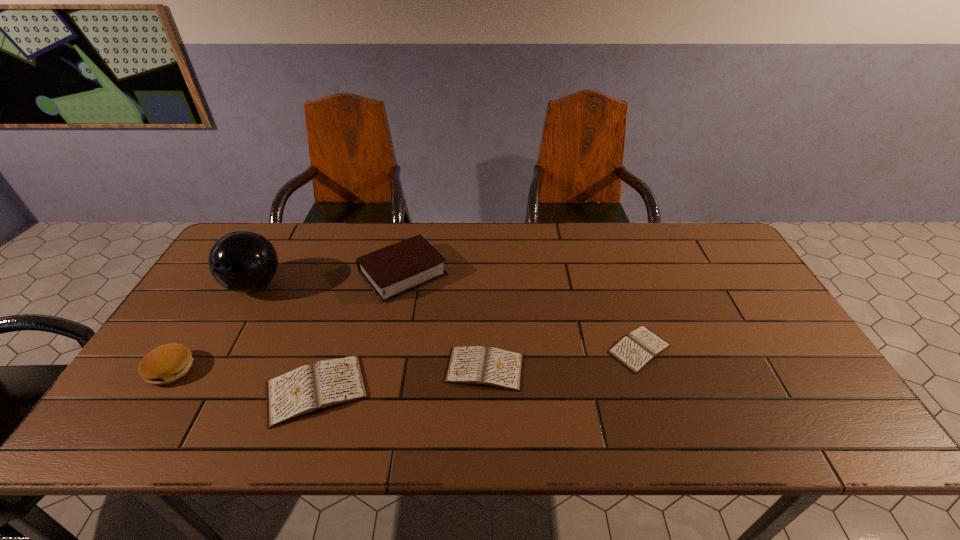
I want to click on the closest diary to the tallest diary, so click(476, 365).

Where is `blank area in the image that satisfies the following two spatial constraints: 1. on the side of the bowling ball with the finger holes; 2. on the right side of the fourth tallest object`? The image size is (960, 540). blank area in the image that satisfies the following two spatial constraints: 1. on the side of the bowling ball with the finger holes; 2. on the right side of the fourth tallest object is located at coordinates (196, 390).

Find the location of a particular element. This screenshot has width=960, height=540. vacant space that satisfies the following two spatial constraints: 1. on the back side of the second diary from left to right; 2. on the right side of the tallest diary is located at coordinates (324, 369).